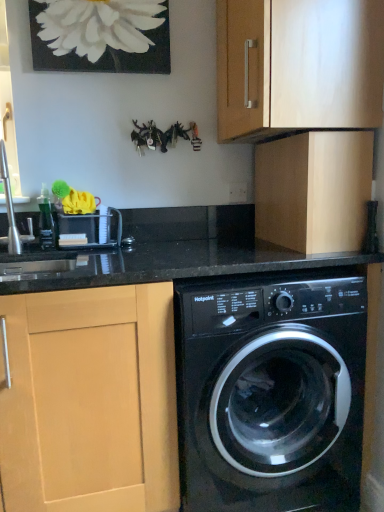
Question: Considering the relative sizes of matte wood cabinet at upper center, which is counted as the 1th cabinetry, starting from the top, and light wood cabinet at left, the 3th cabinetry positioned from the top, in the image provided, is matte wood cabinet at upper center, which is counted as the 1th cabinetry, starting from the top, shorter than light wood cabinet at left, the 3th cabinetry positioned from the top,?

Choices:
 (A) no
 (B) yes

Answer: (B)

Question: Is matte wood cabinet at upper center, which is counted as the 1th cabinetry, starting from the top, at the left side of light wood cabinet at left, the first cabinetry from the left?

Choices:
 (A) no
 (B) yes

Answer: (A)

Question: From a real-world perspective, is matte wood cabinet at upper center, placed as the second cabinetry when sorted from left to right, located higher than light wood cabinet at left, which ranks as the third cabinetry in right-to-left order?

Choices:
 (A) yes
 (B) no

Answer: (A)

Question: Is matte wood cabinet at upper center, the third cabinetry ordered from the bottom, not close to light wood cabinet at left, which ranks as the first cabinetry in bottom-to-top order?

Choices:
 (A) no
 (B) yes

Answer: (A)

Question: Is matte wood cabinet at upper center, the third cabinetry ordered from the bottom, thinner than light wood cabinet at left, which ranks as the first cabinetry in bottom-to-top order?

Choices:
 (A) no
 (B) yes

Answer: (B)

Question: Is matte wood cabinet at upper center, the third cabinetry ordered from the bottom, to the left or to the right of white matte painting at upper center in the image?

Choices:
 (A) right
 (B) left

Answer: (A)

Question: In terms of width, does matte wood cabinet at upper center, the third cabinetry ordered from the bottom, look wider or thinner when compared to white matte painting at upper center?

Choices:
 (A) wide
 (B) thin

Answer: (A)

Question: In the image, is matte wood cabinet at upper center, acting as the 2th cabinetry starting from the right, positioned in front of or behind white matte painting at upper center?

Choices:
 (A) behind
 (B) front

Answer: (B)

Question: From the image's perspective, is matte wood cabinet at upper center, the third cabinetry ordered from the bottom, located above or below white matte painting at upper center?

Choices:
 (A) above
 (B) below

Answer: (B)

Question: Does point (120, 338) appear closer or farther from the camera than point (288, 291)?

Choices:
 (A) farther
 (B) closer

Answer: (B)

Question: Is light wood cabinet at left, the first cabinetry from the left, in front of or behind black glossy washing machine at lower center in the image?

Choices:
 (A) front
 (B) behind

Answer: (A)

Question: In the image, is light wood cabinet at left, the 3th cabinetry positioned from the top, on the left side or the right side of black glossy washing machine at lower center?

Choices:
 (A) right
 (B) left

Answer: (B)

Question: Is light wood cabinet at left, which ranks as the third cabinetry in right-to-left order, spatially inside black glossy washing machine at lower center, or outside of it?

Choices:
 (A) inside
 (B) outside

Answer: (B)

Question: Considering the positions of black glossy washing machine at lower center and matte wood cabinet at upper center, acting as the 2th cabinetry starting from the right, in the image, is black glossy washing machine at lower center bigger or smaller than matte wood cabinet at upper center, acting as the 2th cabinetry starting from the right,?

Choices:
 (A) big
 (B) small

Answer: (A)

Question: In terms of width, does black glossy washing machine at lower center look wider or thinner when compared to matte wood cabinet at upper center, the third cabinetry ordered from the bottom?

Choices:
 (A) wide
 (B) thin

Answer: (A)